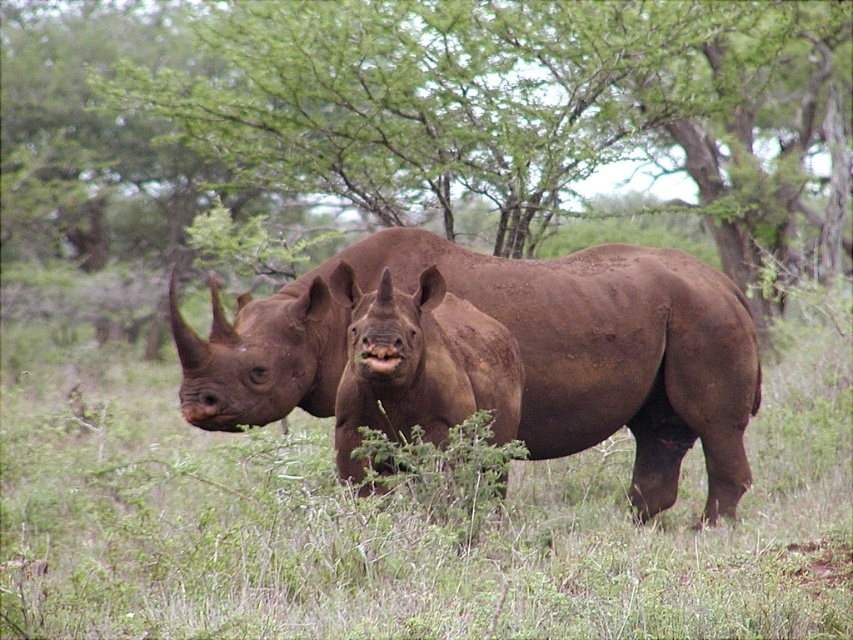
Which of these two, green leafy tree at center or matte brown rhino at center, stands shorter?

matte brown rhino at center is shorter.

Is green leafy tree at center positioned before matte brown rhino at center?

No.

This screenshot has width=853, height=640. I want to click on green leafy tree at center, so click(x=421, y=108).

Does brown matte rhinoceros at center have a greater height compared to matte brown rhino at center?

Yes, brown matte rhinoceros at center is taller than matte brown rhino at center.

What do you see at coordinates (521, 353) in the screenshot? The height and width of the screenshot is (640, 853). I see `brown matte rhinoceros at center` at bounding box center [521, 353].

Between point (715, 316) and point (444, 369), which one is positioned in front?

Point (444, 369)

Where is `brown matte rhinoceros at center`? brown matte rhinoceros at center is located at coordinates (521, 353).

The image size is (853, 640). I want to click on green leafy tree at center, so click(x=421, y=108).

Does green leafy tree at center have a lesser height compared to brown matte rhinoceros at center?

In fact, green leafy tree at center may be taller than brown matte rhinoceros at center.

Find the location of `green leafy tree at center`. green leafy tree at center is located at coordinates (421, 108).

I want to click on green leafy tree at center, so click(421, 108).